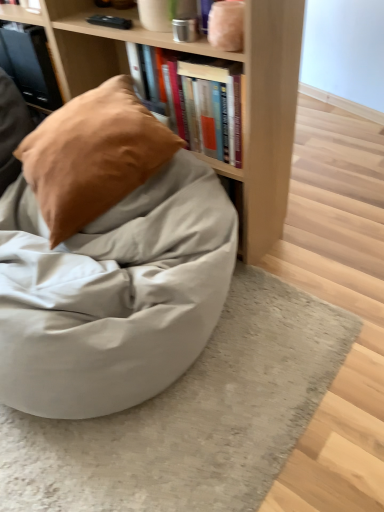
Question: From the image's perspective, does matte black book at upper left, which is the first book from left to right, appear lower than matte gray bean bag at center?

Choices:
 (A) no
 (B) yes

Answer: (A)

Question: From the image's perspective, is matte black book at upper left, which is the 2th book in front-to-back order, above matte gray bean bag at center?

Choices:
 (A) no
 (B) yes

Answer: (B)

Question: Is matte black book at upper left, the first book in the top-to-bottom sequence, facing towards matte gray bean bag at center?

Choices:
 (A) yes
 (B) no

Answer: (B)

Question: From a real-world perspective, is matte black book at upper left, which is the 1th book in back-to-front order, under matte gray bean bag at center?

Choices:
 (A) no
 (B) yes

Answer: (A)

Question: Is matte black book at upper left, which is the 1th book in back-to-front order, turned away from matte gray bean bag at center?

Choices:
 (A) no
 (B) yes

Answer: (A)

Question: Is point (26, 27) closer or farther from the camera than point (34, 177)?

Choices:
 (A) closer
 (B) farther

Answer: (B)

Question: Considering the relative positions of matte black book at upper left, which ranks as the second book in bottom-to-top order, and suede-like tan pillow at upper left in the image provided, is matte black book at upper left, which ranks as the second book in bottom-to-top order, to the left or to the right of suede-like tan pillow at upper left?

Choices:
 (A) right
 (B) left

Answer: (B)

Question: Do you think matte black book at upper left, which is the second book in right-to-left order, is within suede-like tan pillow at upper left, or outside of it?

Choices:
 (A) outside
 (B) inside

Answer: (A)

Question: Considering their positions, is matte black book at upper left, the first book in the top-to-bottom sequence, located in front of or behind suede-like tan pillow at upper left?

Choices:
 (A) behind
 (B) front

Answer: (A)

Question: In terms of height, does suede-like tan pillow at upper left look taller or shorter compared to matte gray bean bag at center?

Choices:
 (A) short
 (B) tall

Answer: (A)

Question: Considering the positions of point (130, 135) and point (213, 300), is point (130, 135) closer or farther from the camera than point (213, 300)?

Choices:
 (A) closer
 (B) farther

Answer: (A)

Question: From a real-world perspective, relative to matte gray bean bag at center, is suede-like tan pillow at upper left vertically above or below?

Choices:
 (A) above
 (B) below

Answer: (A)

Question: From the image's perspective, is suede-like tan pillow at upper left located above or below matte gray bean bag at center?

Choices:
 (A) below
 (B) above

Answer: (B)

Question: Is matte gray bean bag at center in front of or behind suede-like tan pillow at upper left in the image?

Choices:
 (A) front
 (B) behind

Answer: (A)

Question: Considering the positions of matte gray bean bag at center and suede-like tan pillow at upper left in the image, is matte gray bean bag at center wider or thinner than suede-like tan pillow at upper left?

Choices:
 (A) wide
 (B) thin

Answer: (A)